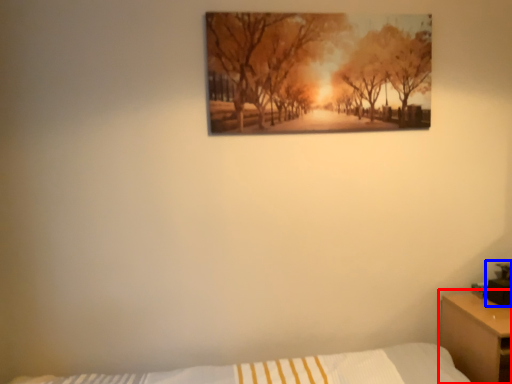
Question: Which object is closer to the camera taking this photo, nightstand (highlighted by a red box) or table lamp (highlighted by a blue box)?

Choices:
 (A) nightstand
 (B) table lamp

Answer: (A)